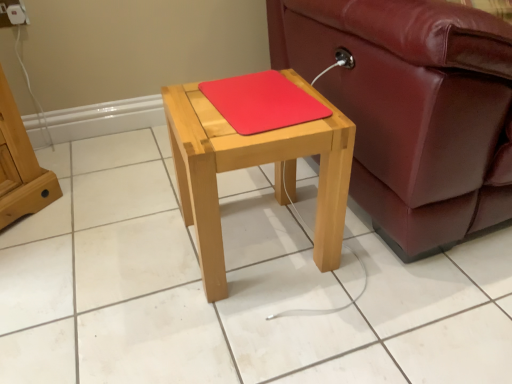
What is the approximate width of white plastic electric outlet at upper left?

white plastic electric outlet at upper left is 0.97 inches in width.

Describe the element at coordinates (413, 109) in the screenshot. I see `leather couch at right` at that location.

This screenshot has height=384, width=512. What are the coordinates of `white plastic electric outlet at upper left` in the screenshot? It's located at pyautogui.click(x=12, y=13).

Can you confirm if leather couch at right is shorter than white plastic electric outlet at upper left?

In fact, leather couch at right may be taller than white plastic electric outlet at upper left.

Which is farther, (410, 15) or (6, 15)?

The point (6, 15) is farther.

Considering the positions of objects leather couch at right and white plastic electric outlet at upper left in the image provided, who is behind, leather couch at right or white plastic electric outlet at upper left?

white plastic electric outlet at upper left is more distant.

Would you consider leather couch at right to be distant from white plastic electric outlet at upper left?

Yes.

In the image, is white plastic electric outlet at upper left on the left side or the right side of leather couch at right?

Clearly, white plastic electric outlet at upper left is on the left of leather couch at right in the image.

Which is in front, point (21, 12) or point (477, 195)?

The point (477, 195) is more forward.

From the picture: From the image's perspective, is white plastic electric outlet at upper left located above or below leather couch at right?

Answer: From the image's perspective, white plastic electric outlet at upper left appears above leather couch at right.

Is white plastic electric outlet at upper left turned away from leather couch at right?

No.

Who is bigger, natural wood table at center or white plastic electric outlet at upper left?

natural wood table at center is bigger.

Is point (321, 161) closer to viewer compared to point (21, 24)?

Yes, point (321, 161) is in front of point (21, 24).

Considering the sizes of objects natural wood table at center and white plastic electric outlet at upper left in the image provided, who is taller, natural wood table at center or white plastic electric outlet at upper left?

natural wood table at center is taller.

From the image's perspective, would you say natural wood table at center is shown under white plastic electric outlet at upper left?

Yes, from the image's perspective, natural wood table at center is below white plastic electric outlet at upper left.

Is rubberized red mousepad at center oriented away from white plastic electric outlet at upper left?

No, rubberized red mousepad at center's orientation is not away from white plastic electric outlet at upper left.

Is point (256, 85) less distant than point (21, 17)?

Yes, point (256, 85) is closer to viewer.

Which is in front, rubberized red mousepad at center or white plastic electric outlet at upper left?

rubberized red mousepad at center.

Identify the location of electric outlet that appears behind the rubberized red mousepad at center. The image size is (512, 384). (12, 13).

Considering the positions of objects white plastic electric outlet at upper left and rubberized red mousepad at center in the image provided, who is more to the right, white plastic electric outlet at upper left or rubberized red mousepad at center?

Positioned to the right is rubberized red mousepad at center.

From the image's perspective, does white plastic electric outlet at upper left appear lower than rubberized red mousepad at center?

No, from the image's perspective, white plastic electric outlet at upper left is not below rubberized red mousepad at center.

Is white plastic electric outlet at upper left oriented away from rubberized red mousepad at center?

No, white plastic electric outlet at upper left is not facing the opposite direction of rubberized red mousepad at center.

Considering their positions, is white plastic electric outlet at upper left located in front of or behind rubberized red mousepad at center?

Visually, white plastic electric outlet at upper left is located behind rubberized red mousepad at center.

From the image's perspective, is natural wood table at center over leather couch at right?

No, from the image's perspective, natural wood table at center is not on top of leather couch at right.

Between natural wood table at center and leather couch at right, which one has larger width?

leather couch at right is wider.

The image size is (512, 384). Find the location of `table lying on the left of leather couch at right`. table lying on the left of leather couch at right is located at coordinates (252, 166).

Consider the image. Is natural wood table at center looking in the opposite direction of leather couch at right?

No.

Is point (260, 131) farther from camera compared to point (455, 134)?

No, (260, 131) is in front of (455, 134).

Is rubberized red mousepad at center outside of leather couch at right?

Yes, rubberized red mousepad at center is located beyond the bounds of leather couch at right.

Is rubberized red mousepad at center shorter than leather couch at right?

Correct, rubberized red mousepad at center is not as tall as leather couch at right.

Looking at this image, can you confirm if rubberized red mousepad at center is positioned to the left of leather couch at right?

Yes, rubberized red mousepad at center is to the left of leather couch at right.

What are the coordinates of `studio couch below the white plastic electric outlet at upper left (from a real-world perspective)` in the screenshot? It's located at (413, 109).

The width and height of the screenshot is (512, 384). Find the location of `electric outlet that appears behind the leather couch at right`. electric outlet that appears behind the leather couch at right is located at coordinates (12, 13).

Which object lies further to the anchor point white plastic electric outlet at upper left, natural wood table at center or leather couch at right?

leather couch at right lies further to white plastic electric outlet at upper left than the other object.

From the image, which object appears to be farther from white plastic electric outlet at upper left, leather couch at right or rubberized red mousepad at center?

Among the two, leather couch at right is located further to white plastic electric outlet at upper left.

Considering their positions, is leather couch at right positioned further to natural wood table at center than white plastic electric outlet at upper left?

white plastic electric outlet at upper left.

From the image, which object appears to be farther from leather couch at right, white plastic electric outlet at upper left or rubberized red mousepad at center?

The object further to leather couch at right is white plastic electric outlet at upper left.

Based on their spatial positions, is rubberized red mousepad at center or leather couch at right further from natural wood table at center?

leather couch at right.

When comparing their distances from natural wood table at center, does white plastic electric outlet at upper left or leather couch at right seem closer?

leather couch at right lies closer to natural wood table at center than the other object.

Looking at the image, which one is located further to rubberized red mousepad at center, leather couch at right or white plastic electric outlet at upper left?

Based on the image, white plastic electric outlet at upper left appears to be further to rubberized red mousepad at center.

When comparing their distances from rubberized red mousepad at center, does leather couch at right or natural wood table at center seem closer?

Based on the image, natural wood table at center appears to be nearer to rubberized red mousepad at center.

Identify the location of pad between natural wood table at center and leather couch at right in the horizontal direction. (262, 102).

Identify the location of pad located between white plastic electric outlet at upper left and leather couch at right in the left-right direction. (262, 102).

Where is `table between white plastic electric outlet at upper left and leather couch at right from left to right`? table between white plastic electric outlet at upper left and leather couch at right from left to right is located at coordinates (252, 166).

Image resolution: width=512 pixels, height=384 pixels. Identify the location of table situated between white plastic electric outlet at upper left and rubberized red mousepad at center from left to right. (252, 166).